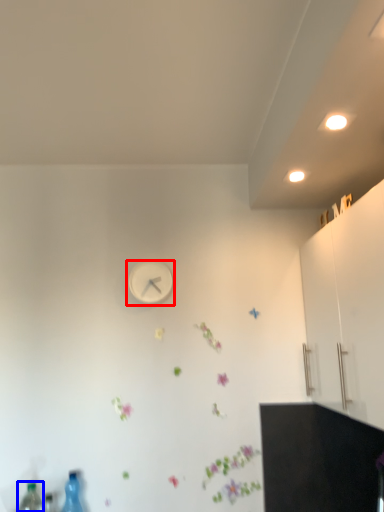
Question: Which object is further to the camera taking this photo, wall clock (highlighted by a red box) or bottle (highlighted by a blue box)?

Choices:
 (A) wall clock
 (B) bottle

Answer: (A)